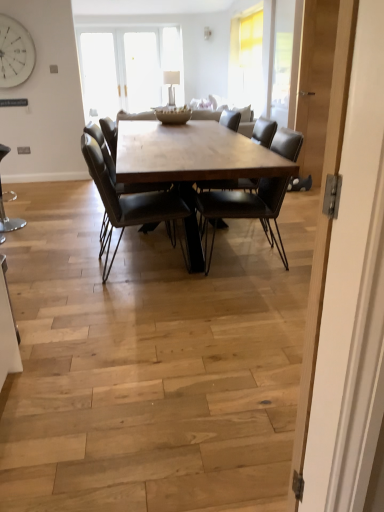
Question: From a real-world perspective, is matte black chair at center, the first chair positioned from the right, under leather chair at center, which is the 2th chair from left to right?

Choices:
 (A) no
 (B) yes

Answer: (A)

Question: Is matte black chair at center, which ranks as the third chair in left-to-right order, not inside leather chair at center, which is the 2th chair from left to right?

Choices:
 (A) yes
 (B) no

Answer: (A)

Question: Considering the relative sizes of matte black chair at center, which ranks as the third chair in left-to-right order, and leather chair at center, marked as the second chair in a right-to-left arrangement, in the image provided, is matte black chair at center, which ranks as the third chair in left-to-right order, wider than leather chair at center, marked as the second chair in a right-to-left arrangement,?

Choices:
 (A) no
 (B) yes

Answer: (B)

Question: Is matte black chair at center, the first chair positioned from the right, in front of leather chair at center, marked as the second chair in a right-to-left arrangement?

Choices:
 (A) yes
 (B) no

Answer: (B)

Question: Can you confirm if matte black chair at center, the first chair positioned from the right, is shorter than leather chair at center, marked as the second chair in a right-to-left arrangement?

Choices:
 (A) yes
 (B) no

Answer: (A)

Question: Considering the positions of point tap(96, 172) and point tap(352, 240), is point tap(96, 172) closer or farther from the camera than point tap(352, 240)?

Choices:
 (A) closer
 (B) farther

Answer: (B)

Question: Looking at the image, does leather chair at center, marked as the second chair in a right-to-left arrangement, seem bigger or smaller compared to light wood door at center?

Choices:
 (A) small
 (B) big

Answer: (B)

Question: From the image's perspective, is leather chair at center, marked as the second chair in a right-to-left arrangement, located above or below light wood door at center?

Choices:
 (A) above
 (B) below

Answer: (A)

Question: Is leather chair at center, marked as the second chair in a right-to-left arrangement, taller or shorter than light wood door at center?

Choices:
 (A) tall
 (B) short

Answer: (B)

Question: Would you say light wood door at center is to the left or to the right of metallic stool at lower left, the 1th chair from the left, in the picture?

Choices:
 (A) right
 (B) left

Answer: (A)

Question: From the image's perspective, is light wood door at center located above or below metallic stool at lower left, the 1th chair from the left?

Choices:
 (A) below
 (B) above

Answer: (A)

Question: Is light wood door at center situated inside metallic stool at lower left, the 1th chair from the left, or outside?

Choices:
 (A) outside
 (B) inside

Answer: (A)

Question: Considering the positions of light wood door at center and metallic stool at lower left, which ranks as the third chair in right-to-left order, in the image, is light wood door at center bigger or smaller than metallic stool at lower left, which ranks as the third chair in right-to-left order,?

Choices:
 (A) big
 (B) small

Answer: (B)

Question: Looking at the image, does leather chair at center, marked as the second chair in a right-to-left arrangement, seem bigger or smaller compared to metallic stool at lower left, which ranks as the third chair in right-to-left order?

Choices:
 (A) small
 (B) big

Answer: (B)

Question: Do you think leather chair at center, marked as the second chair in a right-to-left arrangement, is within metallic stool at lower left, the 1th chair from the left, or outside of it?

Choices:
 (A) inside
 (B) outside

Answer: (B)